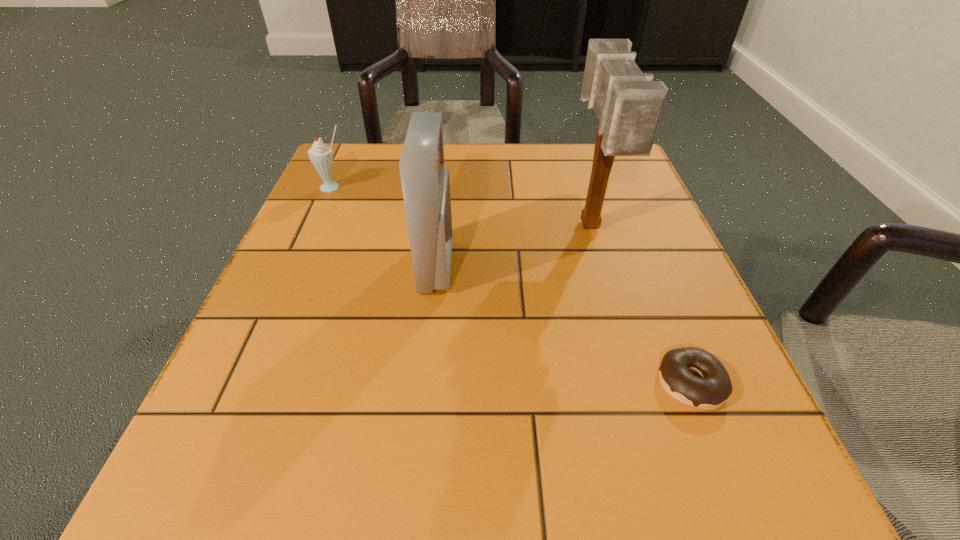
Identify the location of free area in between the shortest object and the tallest object. (640, 305).

Locate an element on the screen. This screenshot has height=540, width=960. vacant point located between the shortest object and the second tallest object is located at coordinates (564, 325).

Where is `empty space that is in between the shortest object and the second shortest object`? The width and height of the screenshot is (960, 540). empty space that is in between the shortest object and the second shortest object is located at coordinates (512, 285).

Find the location of `vacant area that lies between the nearest object and the first-aid kit`. vacant area that lies between the nearest object and the first-aid kit is located at coordinates (564, 325).

Identify the location of free spot between the mallet and the third object from right to left. The height and width of the screenshot is (540, 960). (514, 246).

Locate which object ranks in proximity to the leftmost object. Please provide its 2D coordinates. Your answer should be formatted as a tuple, i.e. [(x, y)], where the tuple contains the x and y coordinates of a point satisfying the conditions above.

[(425, 183)]

At what (x,y) coordinates should I click in order to perform the action: click on the third closest object to the second tallest object. Please return your answer as a coordinate pair (x, y). This screenshot has width=960, height=540. Looking at the image, I should click on (714, 388).

Find the location of a particular element. The height and width of the screenshot is (540, 960). vacant point that satisfies the following two spatial constraints: 1. on the straw side of the mallet; 2. on the right side of the farthest object is located at coordinates (316, 227).

You are a GUI agent. You are given a task and a screenshot of the screen. Output one action in this format:
    pyautogui.click(x=<x>, y=<y>)
    Task: Click on the blank area in the image that satisfies the following two spatial constraints: 1. on the straw side of the second shortest object; 2. on the right side of the tallest object
    
    Given the screenshot: What is the action you would take?
    pyautogui.click(x=316, y=227)

Find the location of a particular element. This screenshot has width=960, height=540. vacant point that satisfies the following two spatial constraints: 1. on the front-facing side of the shortest object; 2. on the left side of the third shortest object is located at coordinates [x=424, y=383].